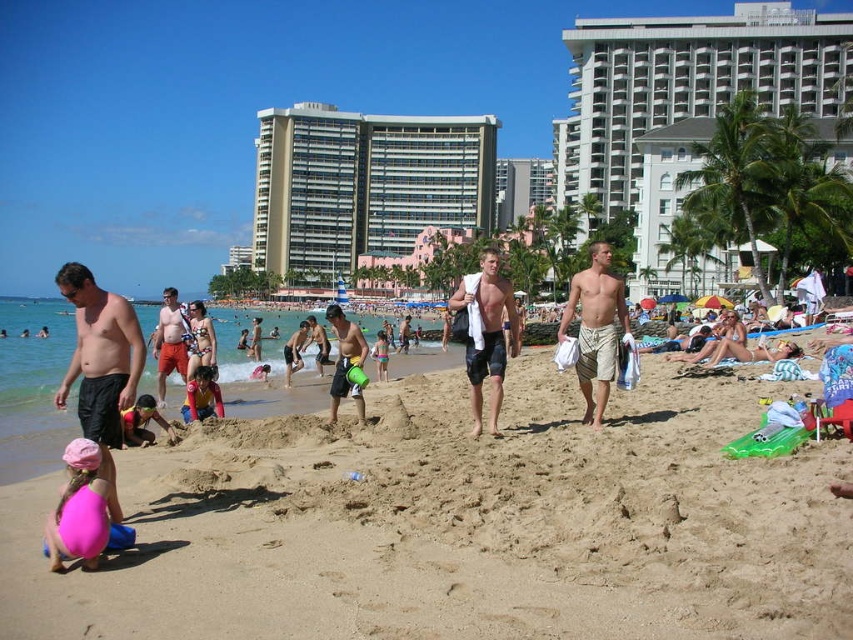
Question: Which point appears farthest from the camera in this image?

Choices:
 (A) (425, 225)
 (B) (733, 596)

Answer: (A)

Question: Does matte black shorts at left appear over matte yellow bucket at center?

Choices:
 (A) no
 (B) yes

Answer: (A)

Question: Is beige textured shorts at center above matte yellow bucket at center?

Choices:
 (A) no
 (B) yes

Answer: (A)

Question: Among these points, which one is nearest to the camera?

Choices:
 (A) (788, 35)
 (B) (199, 484)
 (C) (503, 296)

Answer: (B)

Question: Is white concrete building at upper center positioned at the back of matte red shorts at center?

Choices:
 (A) yes
 (B) no

Answer: (A)

Question: Which object appears closest to the camera in this image?

Choices:
 (A) matte black shorts at left
 (B) beige sandy beach at center
 (C) beige glass building at center
 (D) matte yellow bucket at center

Answer: (B)